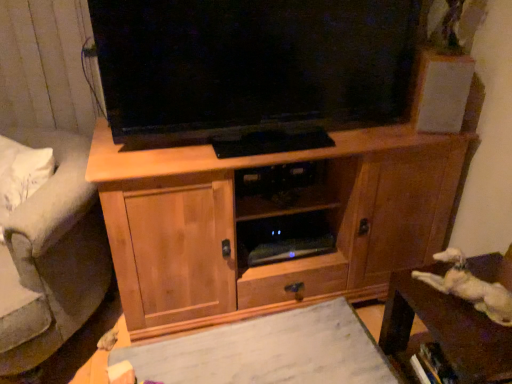
You are a GUI agent. You are given a task and a screenshot of the screen. Output one action in this format:
    pyautogui.click(x=<x>, y=<y>)
    Task: Click on the free space in front of white fluffy cat at lower right
    
    Given the screenshot: What is the action you would take?
    pyautogui.click(x=478, y=332)